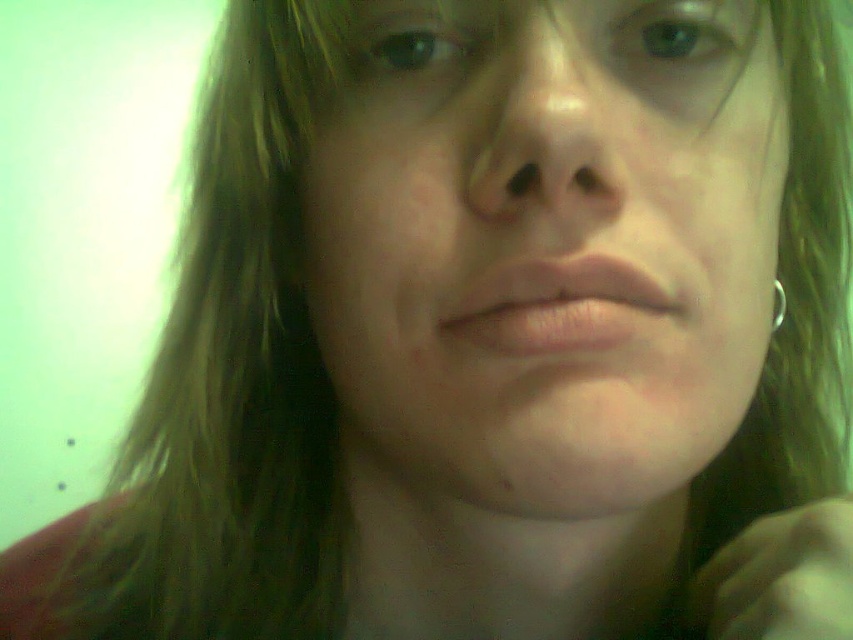
You are a makeup artist analyzing the image. You need to determine which object is wider between the pink matte lips at center and the silver metallic ring at lower right. Based on the scene, which one is wider?

The pink matte lips at center is wider than the silver metallic ring at lower right.

You are a makeup artist analyzing the portrait. You need to determine the spatial relationship between the pink matte lips at center and the silver metallic ring at lower right. Based on the image, which object is positioned to the right side?

The silver metallic ring at lower right is positioned to the right of the pink matte lips at center.

You are holding a 12 inch ruler and want to measure the distance between yourself and the point at coordinates (408,209) in the image. Can you reach it with your ruler?

The distance between you and the point at coordinates (408,209) is 10.97 inches, so yes, your 12 inch ruler can reach it since it is longer than the distance.